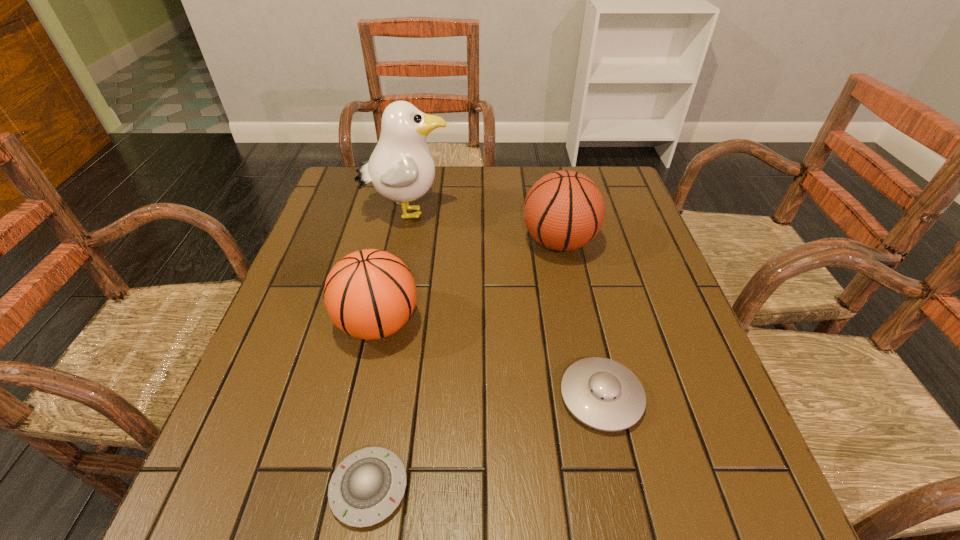
Identify the location of unoccupied area between the left saucer and the farther saucer. (485, 442).

Identify the location of unoccupied area between the nearer saucer and the third nearest object. (373, 406).

Find the location of a particular element. The image size is (960, 540). free spot between the farther basketball and the nearer basketball is located at coordinates (468, 283).

This screenshot has height=540, width=960. I want to click on unoccupied position between the shortest object and the second shortest object, so click(485, 442).

You are a GUI agent. You are given a task and a screenshot of the screen. Output one action in this format:
    pyautogui.click(x=<x>, y=<y>)
    Task: Click on the unoccupied area between the shortest object and the right saucer
    The height and width of the screenshot is (540, 960).
    Given the screenshot: What is the action you would take?
    click(485, 442)

Find the location of a particular element. The image size is (960, 540). unoccupied position between the right saucer and the tallest object is located at coordinates (504, 305).

Where is `vacant space in between the second shortest object and the tallest object`? The width and height of the screenshot is (960, 540). vacant space in between the second shortest object and the tallest object is located at coordinates (504, 305).

The width and height of the screenshot is (960, 540). In order to click on free spot between the second shortest object and the nearer saucer in this screenshot , I will do `click(485, 442)`.

I want to click on object that is the closest to the gull, so click(564, 210).

The image size is (960, 540). I want to click on object that is the second closest one to the gull, so click(369, 294).